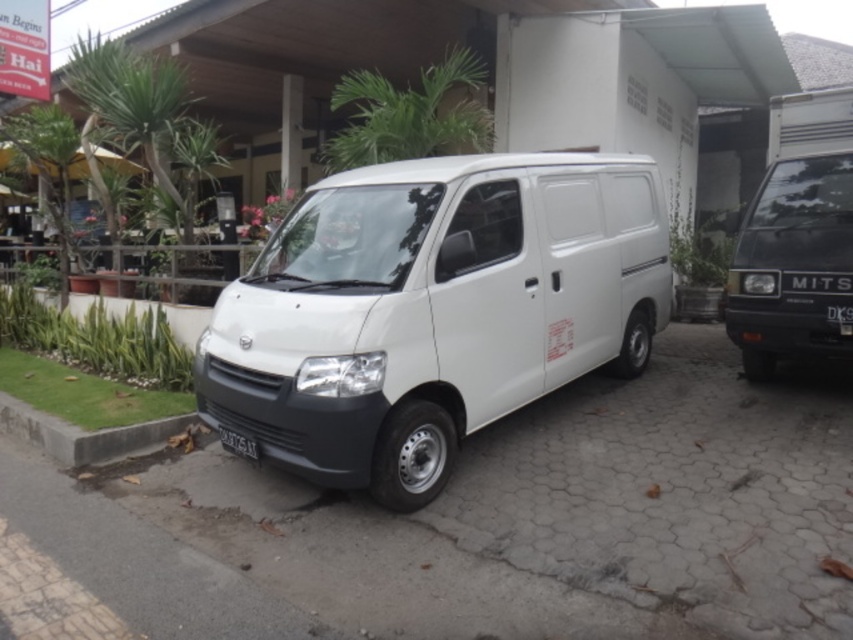
Question: Can you confirm if matte black minibus at right is thinner than black plastic license plate at center?

Choices:
 (A) yes
 (B) no

Answer: (B)

Question: Which of the following is the farthest from the observer?

Choices:
 (A) (410, 444)
 (B) (86, 456)
 (C) (230, 444)

Answer: (B)

Question: Does white matte van at center lie behind black plastic license plate at center?

Choices:
 (A) yes
 (B) no

Answer: (B)

Question: Which object is closer to the camera taking this photo?

Choices:
 (A) matte black minibus at right
 (B) white matte van at center

Answer: (B)

Question: From the image, what is the correct spatial relationship of white matte van at center in relation to white plastic license plate at center?

Choices:
 (A) right
 (B) left

Answer: (A)

Question: Which object appears closest to the camera in this image?

Choices:
 (A) white matte van at center
 (B) white plastic license plate at center

Answer: (A)